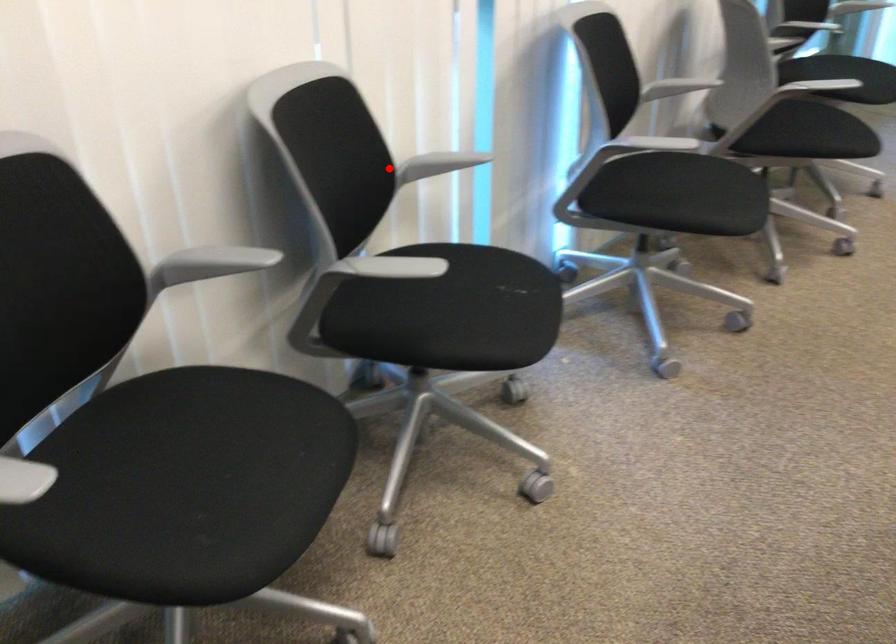
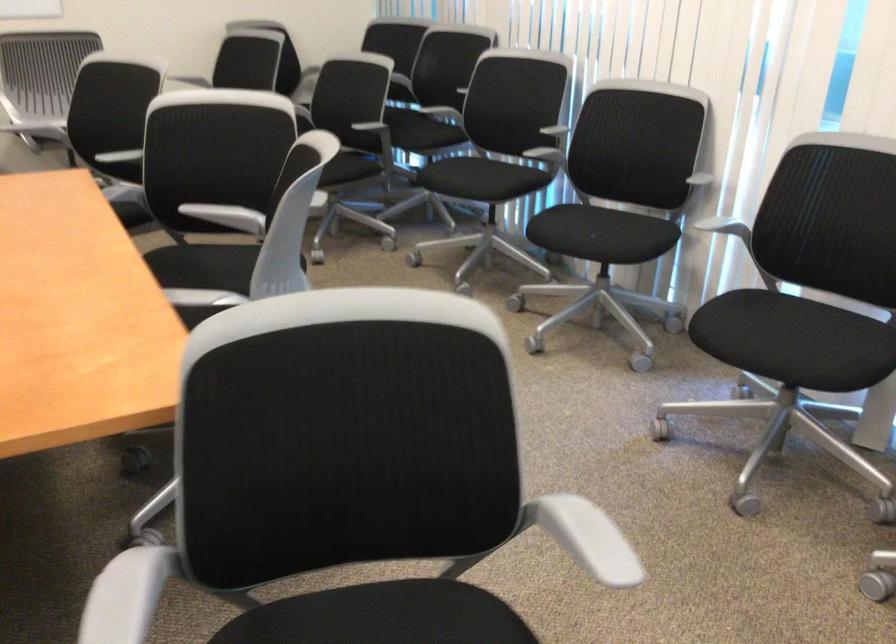
In the second image, find the point that corresponds to the highlighted location in the first image.

(693, 174)